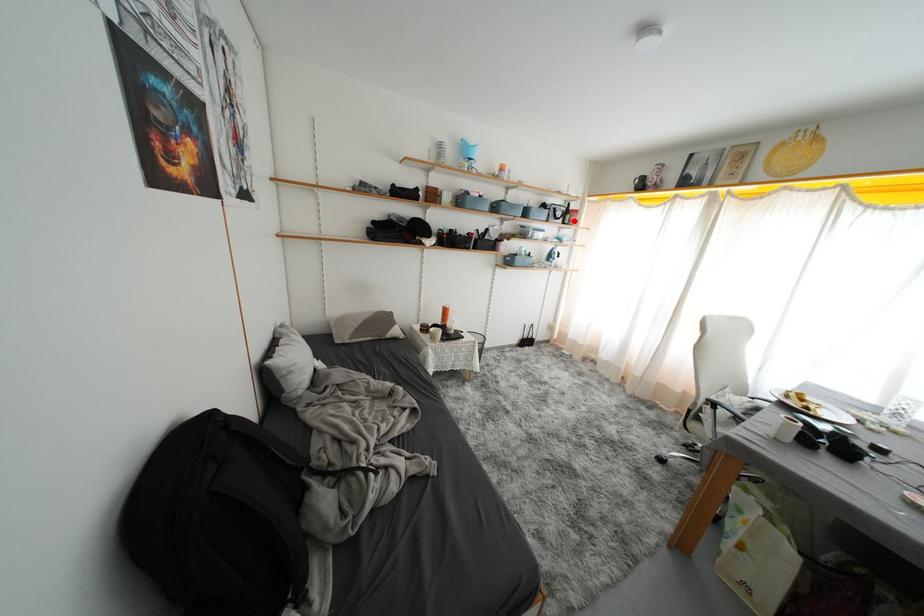
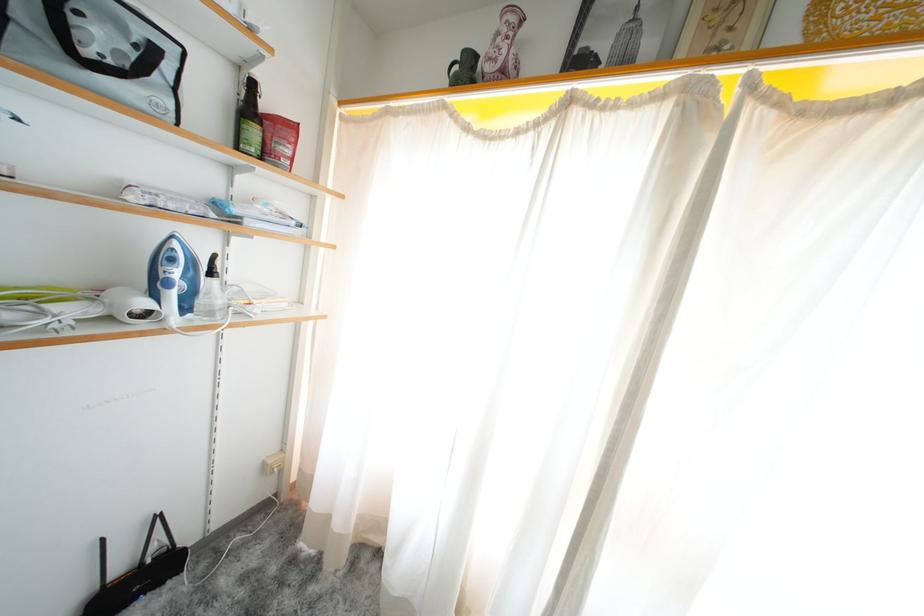
Find the pixel in the second image that matches the highlighted location in the first image.

(261, 137)